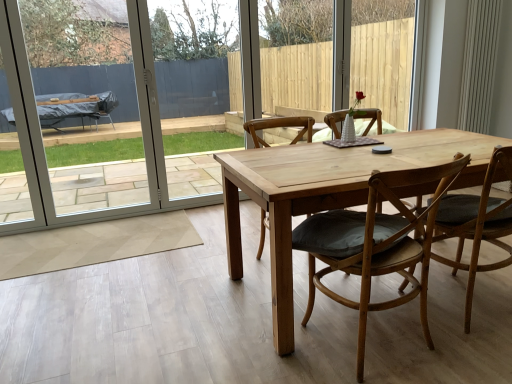
You are a GUI agent. You are given a task and a screenshot of the screen. Output one action in this format:
    pyautogui.click(x=<x>, y=<y>)
    Task: Click on the vacant space underneath wooden chair with cushion at center, the second chair from the right (from a real-world perspective)
    This screenshot has height=384, width=512.
    Given the screenshot: What is the action you would take?
    (388, 351)